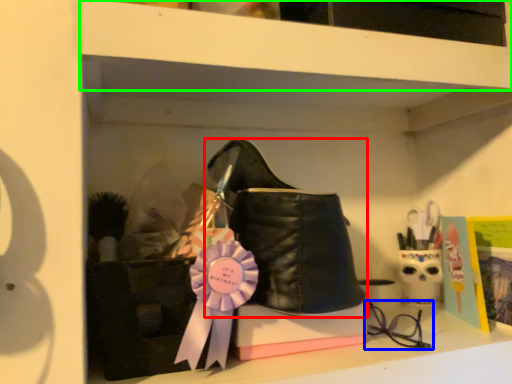
Question: Considering the real-world distances, which object is closest to footwear (highlighted by a red box)? glasses (highlighted by a blue box) or shelf (highlighted by a green box).

Choices:
 (A) glasses
 (B) shelf

Answer: (B)